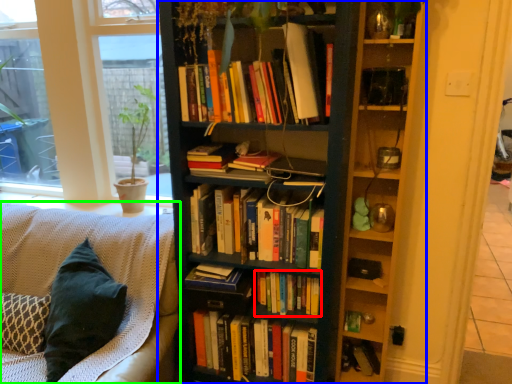
Question: Which object is positioned closest to book (highlighted by a red box)? Select from bookcase (highlighted by a blue box) and studio couch (highlighted by a green box).

Choices:
 (A) bookcase
 (B) studio couch

Answer: (A)